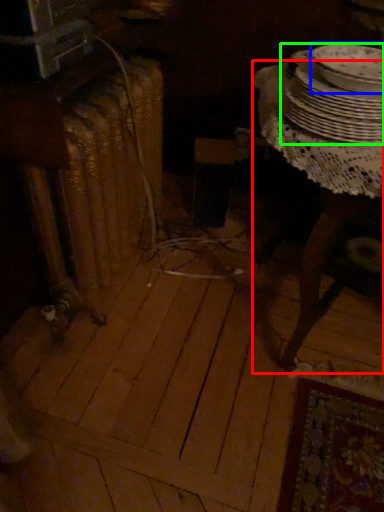
Question: Estimate the real-world distances between objects in this image. Which object is closer to table (highlighted by a red box), tableware (highlighted by a blue box) or tableware (highlighted by a green box)?

Choices:
 (A) tableware
 (B) tableware

Answer: (B)